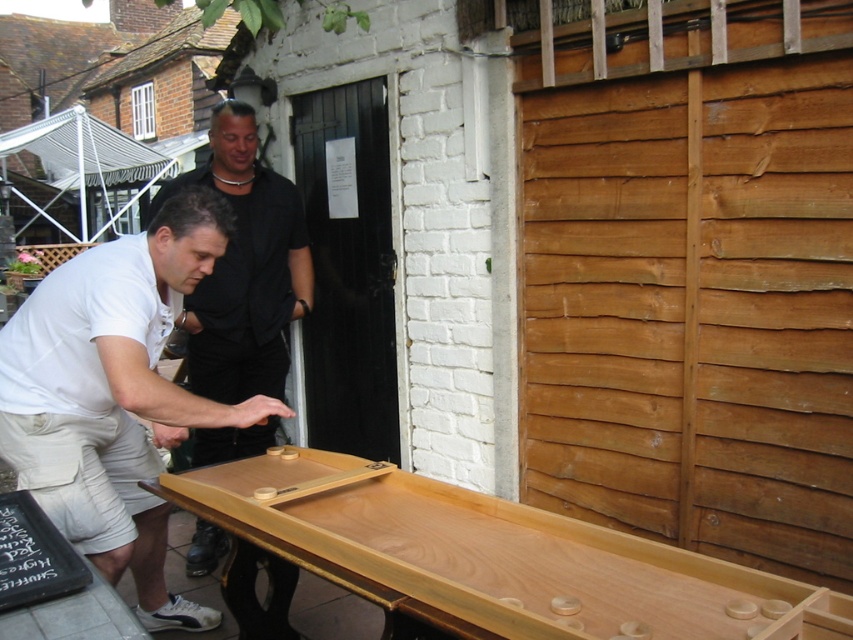
Question: Is natural wood shuffleboard at center above matte black shirt at center?

Choices:
 (A) yes
 (B) no

Answer: (B)

Question: Which of the following is the farthest from the observer?

Choices:
 (A) (228, 381)
 (B) (218, 474)

Answer: (A)

Question: Among these points, which one is farthest from the camera?

Choices:
 (A) (215, 490)
 (B) (6, 378)

Answer: (B)

Question: Which is farther from the natural wood shuffleboard at center?

Choices:
 (A) white cotton shirt at center
 (B) matte black shirt at center

Answer: (B)

Question: Can you confirm if natural wood shuffleboard at center is smaller than matte black shirt at center?

Choices:
 (A) yes
 (B) no

Answer: (A)

Question: Considering the relative positions of white cotton shirt at center and matte black shirt at center in the image provided, where is white cotton shirt at center located with respect to matte black shirt at center?

Choices:
 (A) left
 (B) right

Answer: (B)